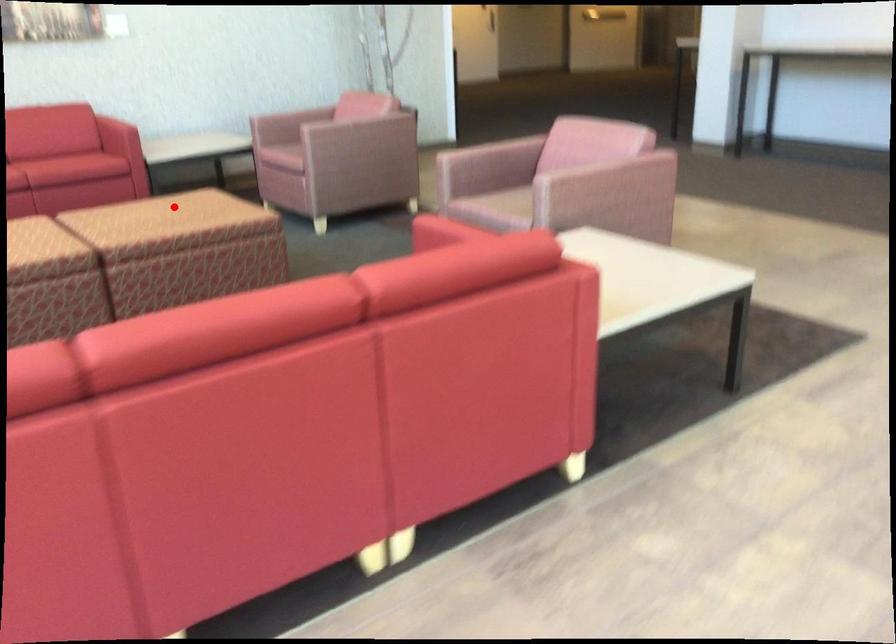
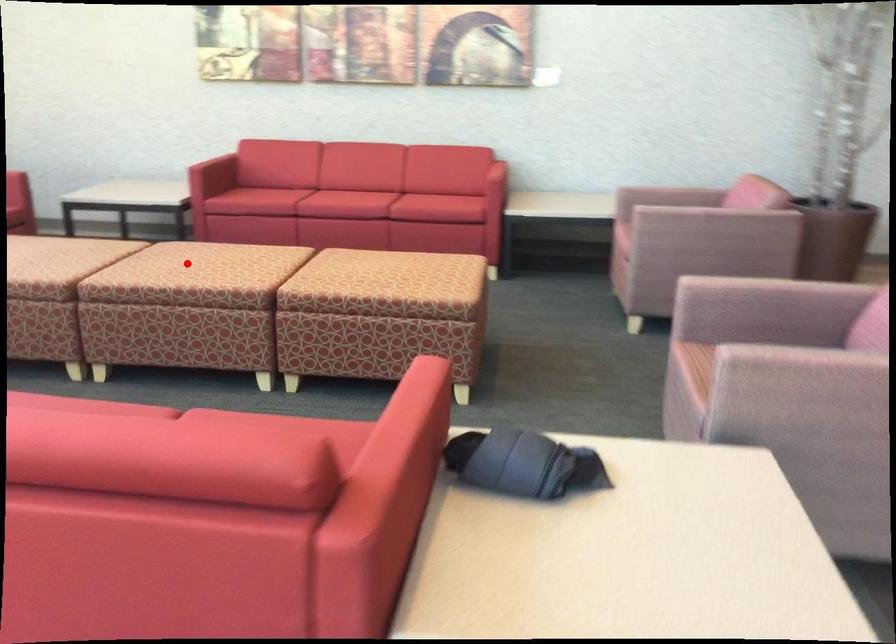
I am providing you with two images of the same scene from different viewpoints. A red point is marked on the first image and another point is marked on the second image. Does the point marked in image1 correspond to the same location as the one in image2?

No